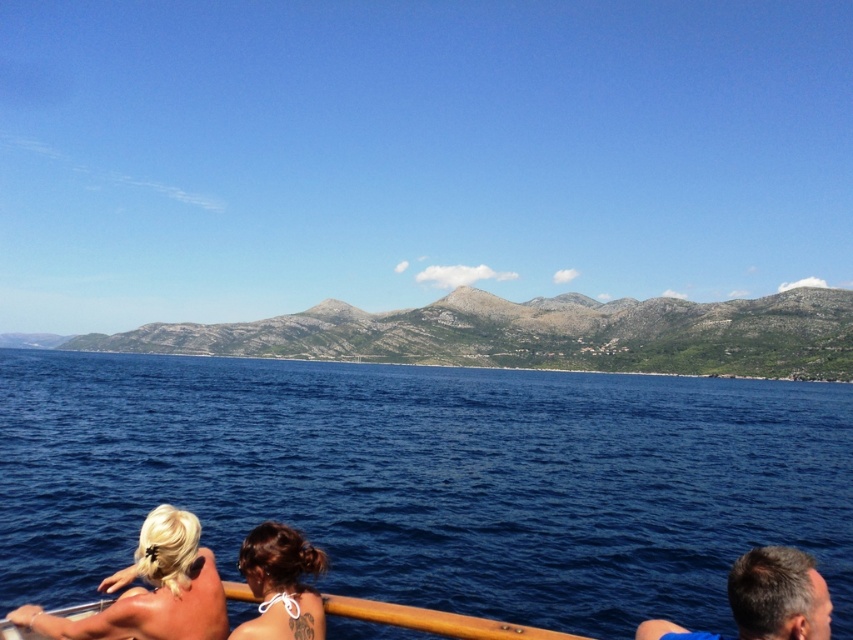
Question: Among these objects, which one is nearest to the camera?

Choices:
 (A) dark brown hair at lower center
 (B) blonde hair at lower left

Answer: (B)

Question: Among these objects, which one is nearest to the camera?

Choices:
 (A) blonde hair at lower left
 (B) deep blue water at center

Answer: (A)

Question: Is deep blue water at center to the left of dark brown hair at lower center from the viewer's perspective?

Choices:
 (A) yes
 (B) no

Answer: (A)

Question: Which point is farther from the camera taking this photo?

Choices:
 (A) (364, 563)
 (B) (238, 557)

Answer: (A)

Question: Is blonde hair at lower left positioned at the back of dark brown hair at lower center?

Choices:
 (A) no
 (B) yes

Answer: (A)

Question: Is deep blue water at center positioned at the back of dark brown hair at lower center?

Choices:
 (A) yes
 (B) no

Answer: (A)